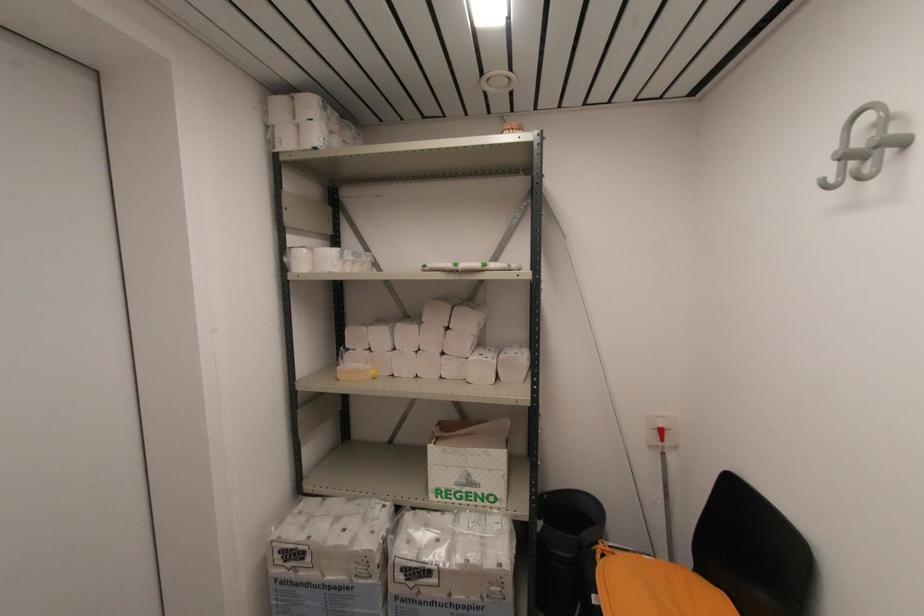
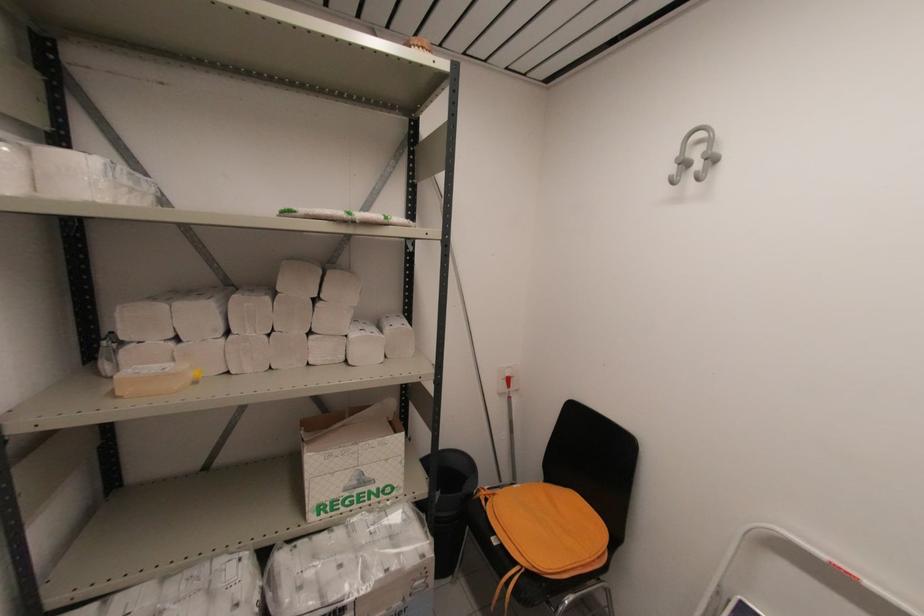
Question: The first image is from the beginning of the video and the second image is from the end. How did the camera likely rotate when shooting the video?

Choices:
 (A) Left
 (B) Right
 (C) Up
 (D) Down

Answer: (B)